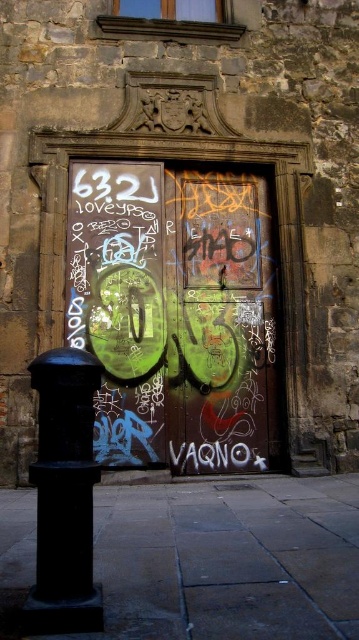
You are a painter who needs to move a ladder from the black matte pole at lower left to the green matte door at center. The ladder is 10 feet long. Can you safely place the ladder between them without it overlapping either object?

The distance between the green matte door at center and the black matte pole at lower left is 9.82 feet. Since the ladder is 10 feet long, it would extend slightly beyond the space between them, making it unsafe to place the ladder without overlapping the objects. You should find a shorter ladder or reposition the objects for a safer setup.

You are a painter standing at the base of the building. You need to paint both the green matte door at center and the black matte pole at lower left. Which object will require a longer ladder to reach its top?

The green matte door at center is much taller than the black matte pole at lower left, so you will need a longer ladder to reach the top of the green matte door at center.

You are a painter who needs to decide which object to paint first between the green matte door at center and the black matte pole at lower left. Since you want to start with the larger one, which one should you choose?

The green matte door at center is larger in size than the black matte pole at lower left, so you should choose to paint the green matte door at center first.